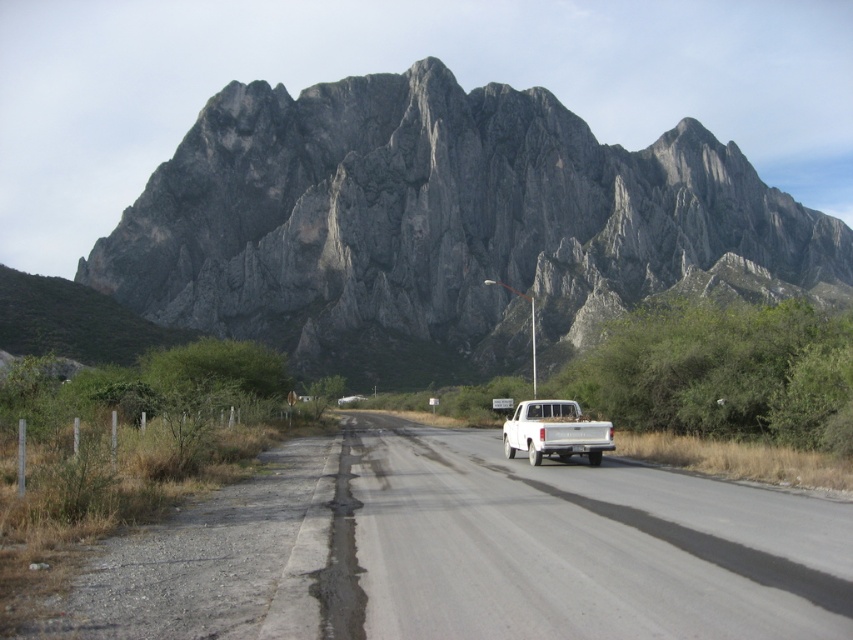
Question: Does white smooth asphalt road at center have a lesser width compared to gravelly asphalt road at lower left?

Choices:
 (A) no
 (B) yes

Answer: (A)

Question: Which object appears farthest from the camera in this image?

Choices:
 (A) white matte truck at center
 (B) white smooth asphalt road at center
 (C) gray rock mountain at upper center
 (D) gravelly asphalt road at lower left

Answer: (C)

Question: Which point is closer to the camera taking this photo?

Choices:
 (A) (564, 429)
 (B) (543, 486)
 (C) (161, 540)

Answer: (C)

Question: Which of the following is the farthest from the observer?

Choices:
 (A) white smooth asphalt road at center
 (B) white matte truck at center

Answer: (B)

Question: Is gray rock mountain at upper center above white matte truck at center?

Choices:
 (A) yes
 (B) no

Answer: (A)

Question: In this image, where is white smooth asphalt road at center located relative to white matte truck at center?

Choices:
 (A) below
 (B) above

Answer: (A)